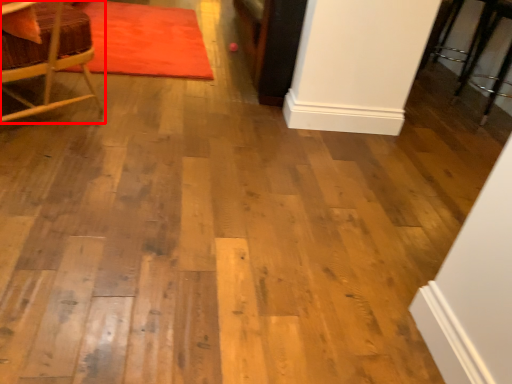
Question: From the image's perspective, where is chair (annotated by the red box) located in relation to mat in the image?

Choices:
 (A) above
 (B) below

Answer: (B)